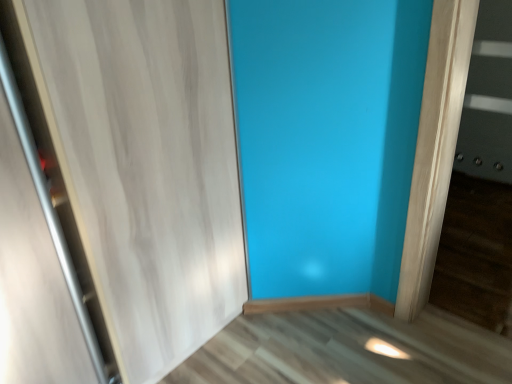
What do you see at coordinates (488, 98) in the screenshot?
I see `black glossy stair at right` at bounding box center [488, 98].

Identify the location of black glossy stair at right. This screenshot has width=512, height=384. (488, 98).

The width and height of the screenshot is (512, 384). I want to click on black glossy stair at right, so click(488, 98).